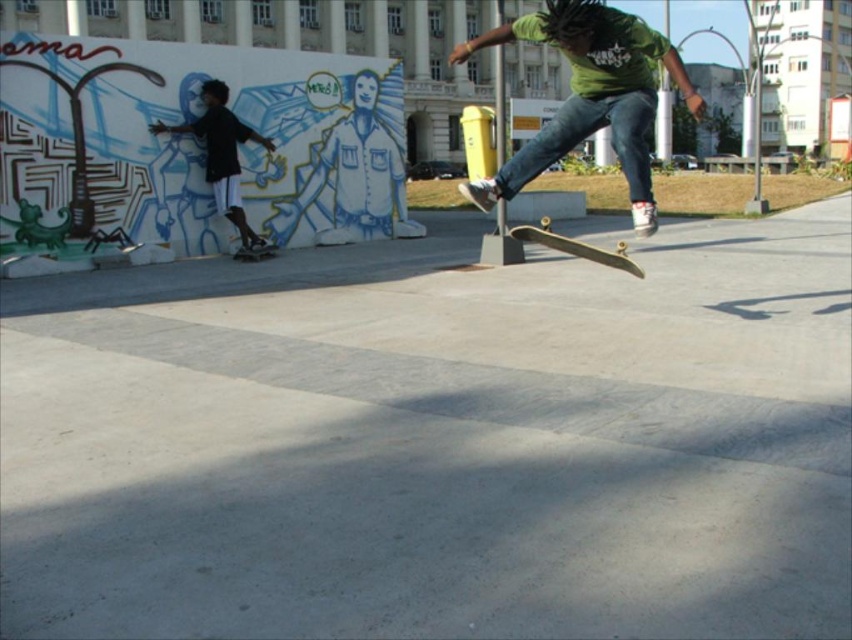
Which is behind, point (631, 266) or point (257, 253)?

Point (257, 253)

Is wooden skateboard at center to the left of wooden skateboard at lower left from the viewer's perspective?

In fact, wooden skateboard at center is to the right of wooden skateboard at lower left.

You are a GUI agent. You are given a task and a screenshot of the screen. Output one action in this format:
    pyautogui.click(x=<x>, y=<y>)
    Task: Click on the wooden skateboard at center
    The width and height of the screenshot is (852, 640).
    Given the screenshot: What is the action you would take?
    pyautogui.click(x=574, y=246)

This screenshot has height=640, width=852. What do you see at coordinates (222, 152) in the screenshot? I see `black matte clothing at left` at bounding box center [222, 152].

Does black matte clothing at left come behind wooden skateboard at center?

Yes, black matte clothing at left is further from the viewer.

Who is more distant from viewer, (222, 172) or (586, 250)?

The point (222, 172) is behind.

At what (x,y) coordinates should I click in order to perform the action: click on black matte clothing at left. Please return your answer as a coordinate pair (x, y). The image size is (852, 640). Looking at the image, I should click on (222, 152).

Which is behind, point (185, 129) or point (271, 248)?

The point (271, 248) is more distant.

Can you confirm if black matte clothing at left is positioned to the left of wooden skateboard at lower left?

Indeed, black matte clothing at left is positioned on the left side of wooden skateboard at lower left.

At what (x,y) coordinates should I click in order to perform the action: click on black matte clothing at left. Please return your answer as a coordinate pair (x, y). This screenshot has width=852, height=640. Looking at the image, I should click on pyautogui.click(x=222, y=152).